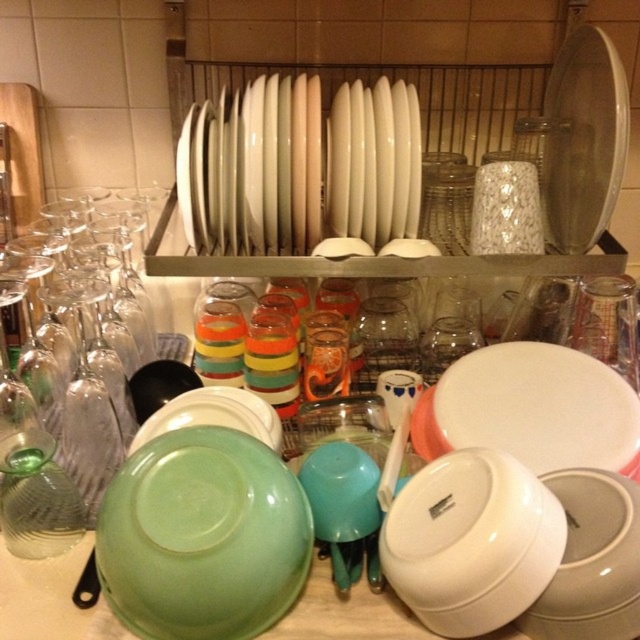
Question: Can you confirm if green matte bowl at lower left is wider than green plastic bowl at center?

Choices:
 (A) yes
 (B) no

Answer: (A)

Question: Which object is the farthest from the white glossy plates at center?

Choices:
 (A) green matte bowl at lower left
 (B) transparent glass plate at upper right
 (C) transparent glass wine glass at left

Answer: (A)

Question: Which point appears farthest from the camera in this image?

Choices:
 (A) (592, 216)
 (B) (68, 413)

Answer: (A)

Question: Can you confirm if green matte bowl at lower left is thinner than white glossy plates at center?

Choices:
 (A) yes
 (B) no

Answer: (A)

Question: Does green matte bowl at lower left appear on the left side of transparent glass plate at upper right?

Choices:
 (A) yes
 (B) no

Answer: (A)

Question: Which object appears closest to the camera in this image?

Choices:
 (A) white glossy platter at center
 (B) transparent glass plate at upper right
 (C) green matte bowl at lower left
 (D) white glossy plates at center

Answer: (C)